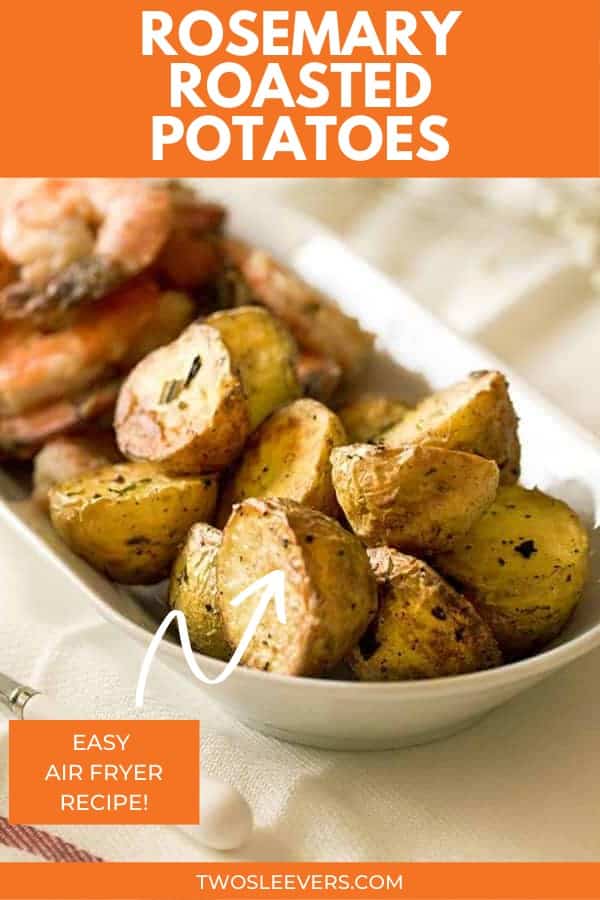
At what (x,y) coordinates should I click in order to perform the action: click on utensil handle. Please return your answer as a coordinate pair (x, y). This screenshot has height=900, width=600. Looking at the image, I should click on (223, 799).